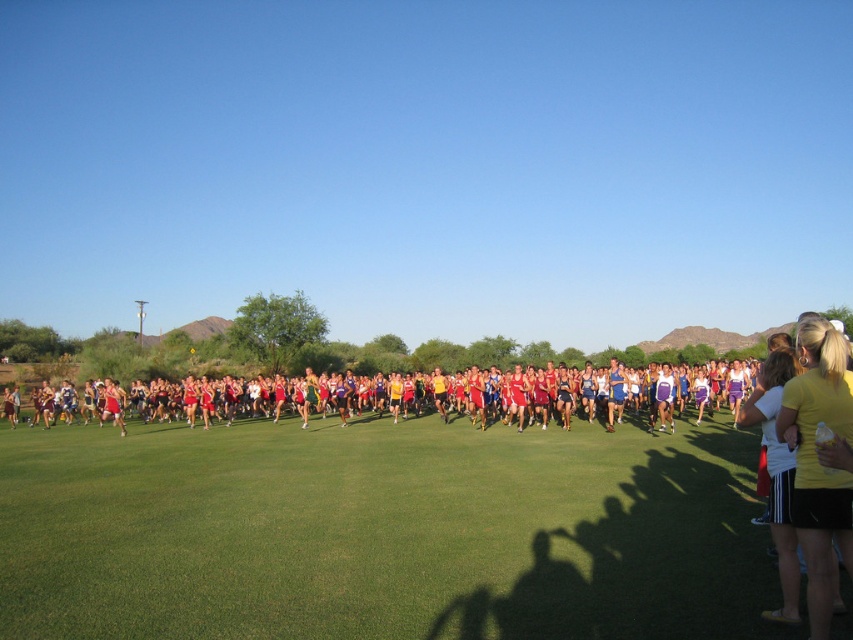
Question: Which of the following is the farthest from the observer?

Choices:
 (A) (70, 355)
 (B) (817, 420)

Answer: (A)

Question: Which of the following is the closest to the observer?

Choices:
 (A) green grass at center
 (B) matte red shorts at center
 (C) yellow fabric at right

Answer: (C)

Question: Can you confirm if yellow fabric at right is positioned to the left of matte red shorts at center?

Choices:
 (A) no
 (B) yes

Answer: (A)

Question: Which object is the closest to the green grass at center?

Choices:
 (A) matte red shorts at center
 (B) yellow fabric at right

Answer: (B)

Question: Is green grass at center to the right of yellow fabric at right from the viewer's perspective?

Choices:
 (A) no
 (B) yes

Answer: (A)

Question: Can you confirm if yellow fabric at right is thinner than matte red shorts at center?

Choices:
 (A) no
 (B) yes

Answer: (B)